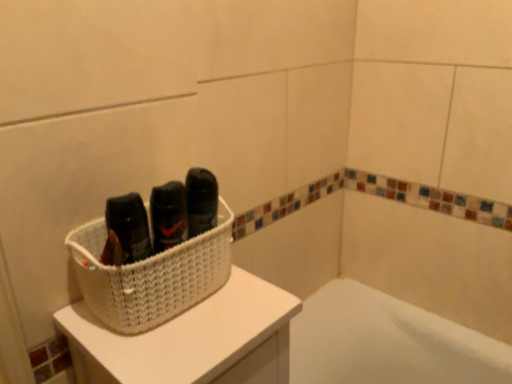
Find the location of `unoccupied region to the right of white woven basket at upper left`. unoccupied region to the right of white woven basket at upper left is located at coordinates (245, 308).